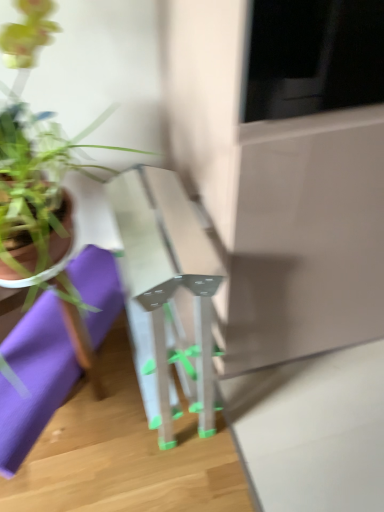
Question: Considering the relative sizes of purple fabric at lower left and transparent plastic table at center in the image provided, is purple fabric at lower left wider than transparent plastic table at center?

Choices:
 (A) yes
 (B) no

Answer: (B)

Question: From a real-world perspective, is purple fabric at lower left beneath transparent plastic table at center?

Choices:
 (A) yes
 (B) no

Answer: (A)

Question: Does purple fabric at lower left come in front of transparent plastic table at center?

Choices:
 (A) no
 (B) yes

Answer: (A)

Question: Considering the relative sizes of purple fabric at lower left and transparent plastic table at center in the image provided, is purple fabric at lower left thinner than transparent plastic table at center?

Choices:
 (A) yes
 (B) no

Answer: (A)

Question: From the image's perspective, would you say purple fabric at lower left is shown under transparent plastic table at center?

Choices:
 (A) no
 (B) yes

Answer: (B)

Question: From the image's perspective, does purple fabric at lower left appear higher than transparent plastic table at center?

Choices:
 (A) no
 (B) yes

Answer: (A)

Question: From a real-world perspective, does green matte plant pot at left stand above transparent plastic table at center?

Choices:
 (A) yes
 (B) no

Answer: (A)

Question: Considering the relative sizes of green matte plant pot at left and transparent plastic table at center in the image provided, is green matte plant pot at left thinner than transparent plastic table at center?

Choices:
 (A) yes
 (B) no

Answer: (A)

Question: Is green matte plant pot at left in front of transparent plastic table at center?

Choices:
 (A) yes
 (B) no

Answer: (A)

Question: Is green matte plant pot at left to the right of transparent plastic table at center from the viewer's perspective?

Choices:
 (A) no
 (B) yes

Answer: (A)

Question: From a real-world perspective, is green matte plant pot at left under transparent plastic table at center?

Choices:
 (A) no
 (B) yes

Answer: (A)

Question: Does green matte plant pot at left have a smaller size compared to transparent plastic table at center?

Choices:
 (A) yes
 (B) no

Answer: (A)

Question: Does transparent plastic table at center turn towards green matte plant pot at left?

Choices:
 (A) no
 (B) yes

Answer: (A)